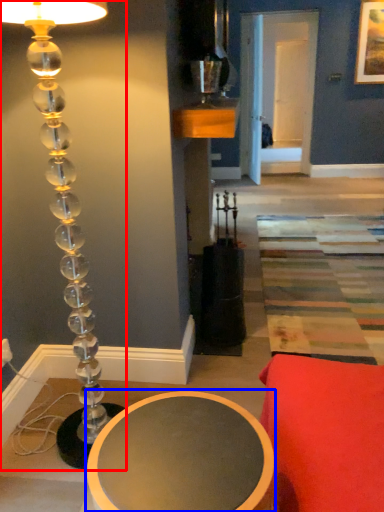
Question: Which object is closer to the camera taking this photo, lamp (highlighted by a red box) or table (highlighted by a blue box)?

Choices:
 (A) lamp
 (B) table

Answer: (B)